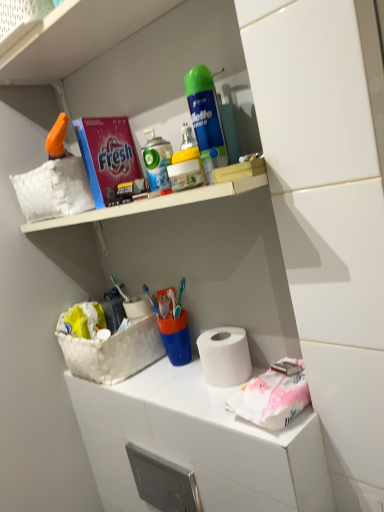
Find the location of `free location to the left of pink paper at lower right`. free location to the left of pink paper at lower right is located at coordinates (197, 406).